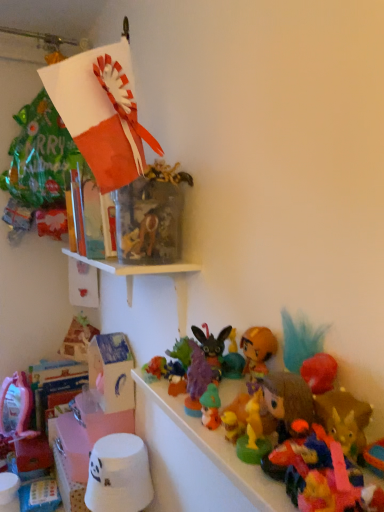
Question: Is point (329, 501) positioned closer to the camera than point (150, 437)?

Choices:
 (A) farther
 (B) closer

Answer: (B)

Question: Relative to plush brown bear at center, the second toy in the front-to-back sequence, is plush multicolored toy at lower right, the 11th toy in the left-to-right sequence, in front or behind?

Choices:
 (A) behind
 (B) front

Answer: (B)

Question: Which of these objects is positioned farthest from the blue cardboard box at lower left?

Choices:
 (A) plush brown bear at center, arranged as the 3th toy when viewed from the right
 (B) plush multicolored toy at lower right, the 11th toy in the left-to-right sequence
 (C) translucent plastic toy at center, the fifth toy when ordered from front to back
 (D) translucent plastic toy at center, which is the third toy from left to right
 (E) orange matte figurine at center-right, the 6th toy viewed from the front

Answer: (B)

Question: Which object is the farthest from the white matte bucket at lower left, the second toy in the left-to-right sequence?

Choices:
 (A) translucent plastic toy at center, which appears as the eighth toy when viewed from the front
 (B) plush multicolored toy at lower right, placed as the first toy when sorted from front to back
 (C) translucent plastic toy at center, which is counted as the seventh toy, starting from the back
 (D) blue cardboard box at lower left
 (E) velvet purple plush rabbit at center, which appears as the seventh toy when viewed from the front

Answer: (B)